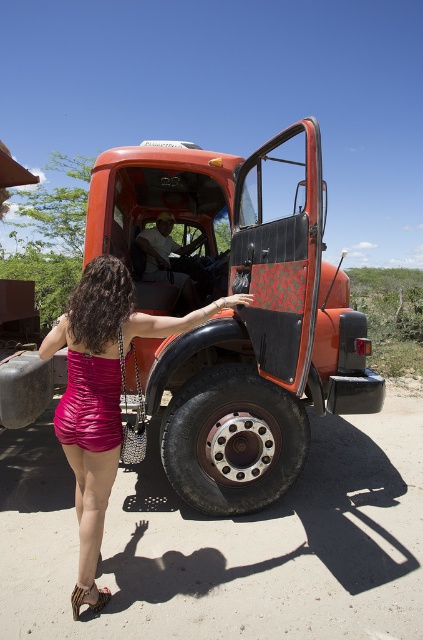
Does metallic red truck at center have a lesser height compared to shiny pink dress at center?

No.

Which is above, metallic red truck at center or shiny pink dress at center?

Positioned higher is metallic red truck at center.

Who is more distant from viewer, (154, 300) or (87, 291)?

The point (154, 300) is more distant.

Image resolution: width=423 pixels, height=640 pixels. In order to click on metallic red truck at center in this screenshot , I will do 241,314.

Is metallic red truck at center bigger than black rubber tire at lower center?

Yes, metallic red truck at center is bigger than black rubber tire at lower center.

From the picture: Is metallic red truck at center to the right of black rubber tire at lower center from the viewer's perspective?

Indeed, metallic red truck at center is positioned on the right side of black rubber tire at lower center.

This screenshot has width=423, height=640. Find the location of `metallic red truck at center`. metallic red truck at center is located at coordinates pyautogui.click(x=241, y=314).

Is shiny pink dress at center above leather textured sandal at lower left?

Yes.

The height and width of the screenshot is (640, 423). Describe the element at coordinates (102, 385) in the screenshot. I see `shiny pink dress at center` at that location.

You are a GUI agent. You are given a task and a screenshot of the screen. Output one action in this format:
    pyautogui.click(x=<x>, y=<y>)
    Task: Click on the shiny pink dress at center
    The height and width of the screenshot is (640, 423).
    Given the screenshot: What is the action you would take?
    pyautogui.click(x=102, y=385)